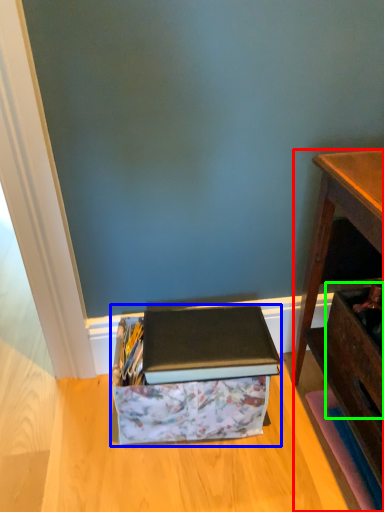
Question: Based on their relative distances, which object is farther from desk (highlighted by a red box)? Choose from storage box (highlighted by a blue box) and drawer (highlighted by a green box).

Choices:
 (A) storage box
 (B) drawer

Answer: (A)